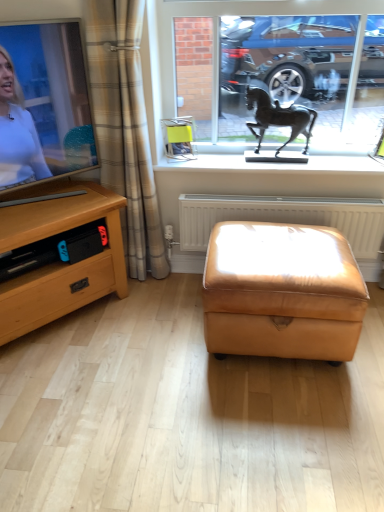
Identify the location of vacant space that's between wooden desk at left and saddle brown leather ottoman at center. Image resolution: width=384 pixels, height=512 pixels. (140, 330).